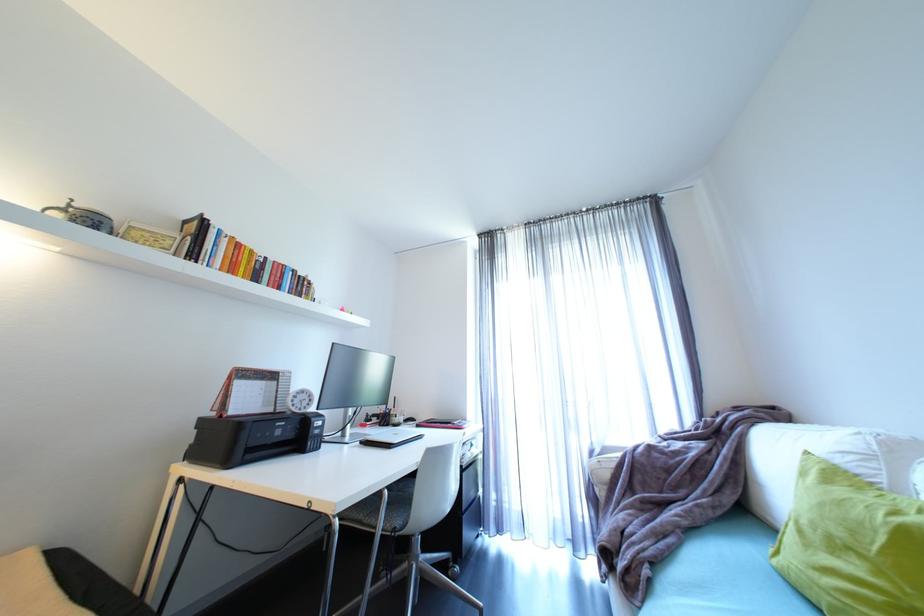
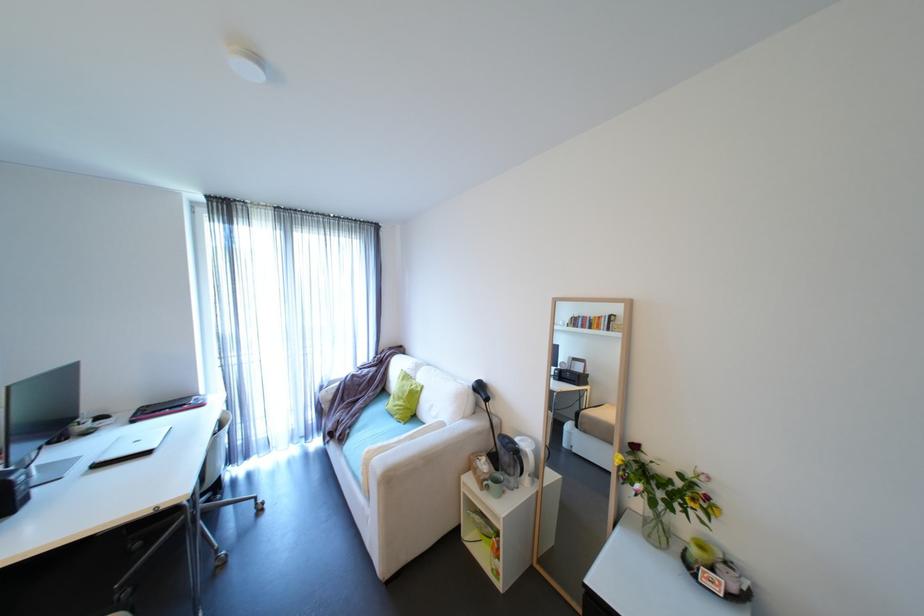
Locate, in the second image, the point that corresponds to pixel 604 451 in the first image.

(333, 386)